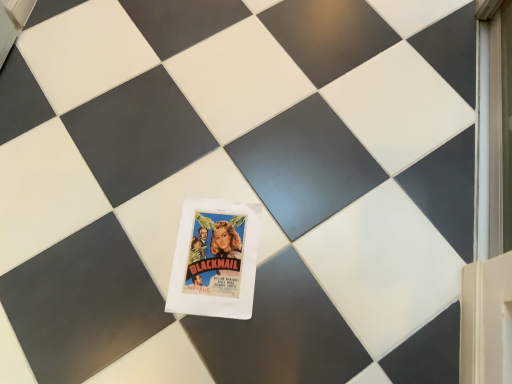
I want to click on vacant space underneath matte paper poster at center (from a real-world perspective), so click(215, 251).